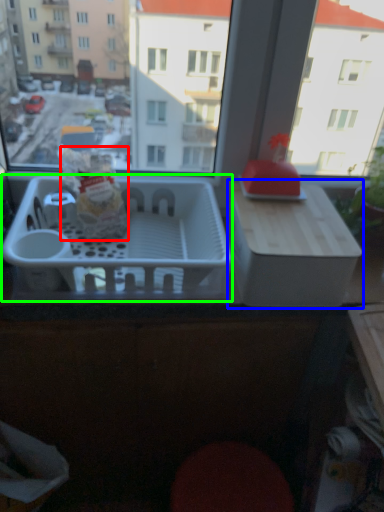
Question: Which is farther away from snack (highlighted by a red box)? cardboard box (highlighted by a blue box) or basket (highlighted by a green box)?

Choices:
 (A) cardboard box
 (B) basket

Answer: (A)